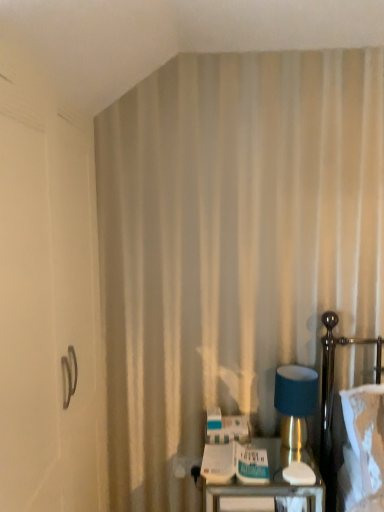
Question: Should I look upward or downward to see white fabric bed at right?

Choices:
 (A) up
 (B) down

Answer: (B)

Question: Does white fabric bed at right have a lesser height compared to matte blue fabric at right?

Choices:
 (A) no
 (B) yes

Answer: (A)

Question: Does white fabric bed at right come behind matte blue fabric at right?

Choices:
 (A) no
 (B) yes

Answer: (A)

Question: Is white fabric bed at right positioned in front of matte blue fabric at right?

Choices:
 (A) yes
 (B) no

Answer: (A)

Question: From the image's perspective, is white fabric bed at right on matte blue fabric at right?

Choices:
 (A) no
 (B) yes

Answer: (A)

Question: Can you confirm if white fabric bed at right is bigger than matte blue fabric at right?

Choices:
 (A) yes
 (B) no

Answer: (A)

Question: From a real-world perspective, is white fabric bed at right positioned under matte blue fabric at right based on gravity?

Choices:
 (A) yes
 (B) no

Answer: (A)

Question: Is matte blue fabric at right wider than white fabric bed at right?

Choices:
 (A) no
 (B) yes

Answer: (A)

Question: From a real-world perspective, is matte blue fabric at right under white fabric bed at right?

Choices:
 (A) yes
 (B) no

Answer: (B)

Question: Is matte blue fabric at right shorter than white fabric bed at right?

Choices:
 (A) yes
 (B) no

Answer: (A)

Question: Could you tell me if matte blue fabric at right is facing white fabric bed at right?

Choices:
 (A) no
 (B) yes

Answer: (A)

Question: Considering the relative sizes of matte blue fabric at right and white fabric bed at right in the image provided, is matte blue fabric at right smaller than white fabric bed at right?

Choices:
 (A) yes
 (B) no

Answer: (A)

Question: Would you say matte blue fabric at right is outside white fabric bed at right?

Choices:
 (A) yes
 (B) no

Answer: (A)

Question: Considering the relative sizes of metallic handle at left and matte blue fabric at right in the image provided, is metallic handle at left shorter than matte blue fabric at right?

Choices:
 (A) yes
 (B) no

Answer: (B)